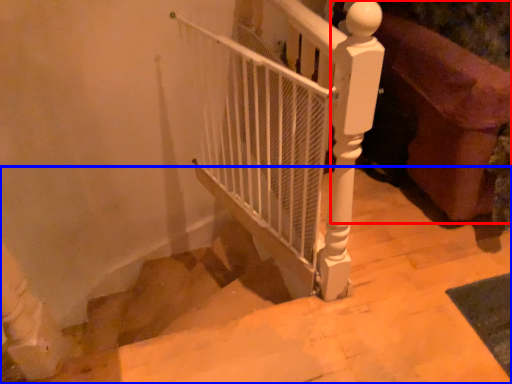
Question: Which point is closer to the camera, furniture (highlighted by a red box) or stairs (highlighted by a blue box)?

Choices:
 (A) furniture
 (B) stairs

Answer: (B)